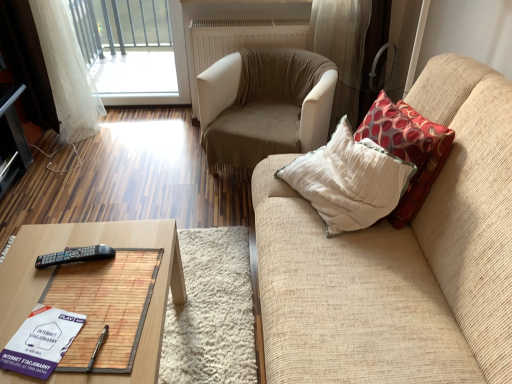
Question: Does transparent glass window at upper left lie behind woodenwoodentable at lower left?

Choices:
 (A) yes
 (B) no

Answer: (A)

Question: Does transparent glass window at upper left appear on the right side of woodenwoodentable at lower left?

Choices:
 (A) no
 (B) yes

Answer: (A)

Question: Considering the relative sizes of transparent glass window at upper left and woodenwoodentable at lower left in the image provided, is transparent glass window at upper left taller than woodenwoodentable at lower left?

Choices:
 (A) no
 (B) yes

Answer: (B)

Question: From a real-world perspective, is transparent glass window at upper left over woodenwoodentable at lower left?

Choices:
 (A) yes
 (B) no

Answer: (A)

Question: Does transparent glass window at upper left have a larger size compared to woodenwoodentable at lower left?

Choices:
 (A) yes
 (B) no

Answer: (B)

Question: Considering the relative positions of black plastic remote at lower left and woodenwoodentable at lower left in the image provided, is black plastic remote at lower left to the left or to the right of woodenwoodentable at lower left?

Choices:
 (A) left
 (B) right

Answer: (A)

Question: Would you say black plastic remote at lower left is inside or outside woodenwoodentable at lower left?

Choices:
 (A) inside
 (B) outside

Answer: (B)

Question: From the image's perspective, is black plastic remote at lower left located above or below woodenwoodentable at lower left?

Choices:
 (A) above
 (B) below

Answer: (A)

Question: Looking at their shapes, would you say black plastic remote at lower left is wider or thinner than woodenwoodentable at lower left?

Choices:
 (A) thin
 (B) wide

Answer: (A)

Question: Considering the positions of woodenwoodentable at lower left and red patterned fabric pillow at right in the image, is woodenwoodentable at lower left bigger or smaller than red patterned fabric pillow at right?

Choices:
 (A) small
 (B) big

Answer: (B)

Question: Relative to red patterned fabric pillow at right, is woodenwoodentable at lower left in front or behind?

Choices:
 (A) front
 (B) behind

Answer: (A)

Question: From their relative heights in the image, would you say woodenwoodentable at lower left is taller or shorter than red patterned fabric pillow at right?

Choices:
 (A) short
 (B) tall

Answer: (A)

Question: In terms of width, does woodenwoodentable at lower left look wider or thinner when compared to red patterned fabric pillow at right?

Choices:
 (A) thin
 (B) wide

Answer: (B)

Question: From a real-world perspective, is purple paper book at lower left above or below transparent glass window at upper left?

Choices:
 (A) above
 (B) below

Answer: (A)

Question: In the image, is purple paper book at lower left on the left side or the right side of transparent glass window at upper left?

Choices:
 (A) left
 (B) right

Answer: (B)